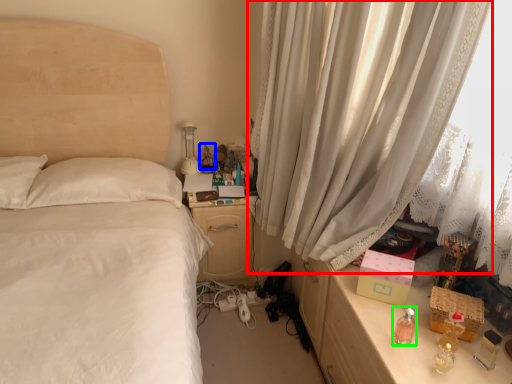
Question: Based on their relative distances, which object is nearer to curtain (highlighted by a red box)? Choose from toy (highlighted by a blue box) and perfume (highlighted by a green box).

Choices:
 (A) toy
 (B) perfume

Answer: (B)